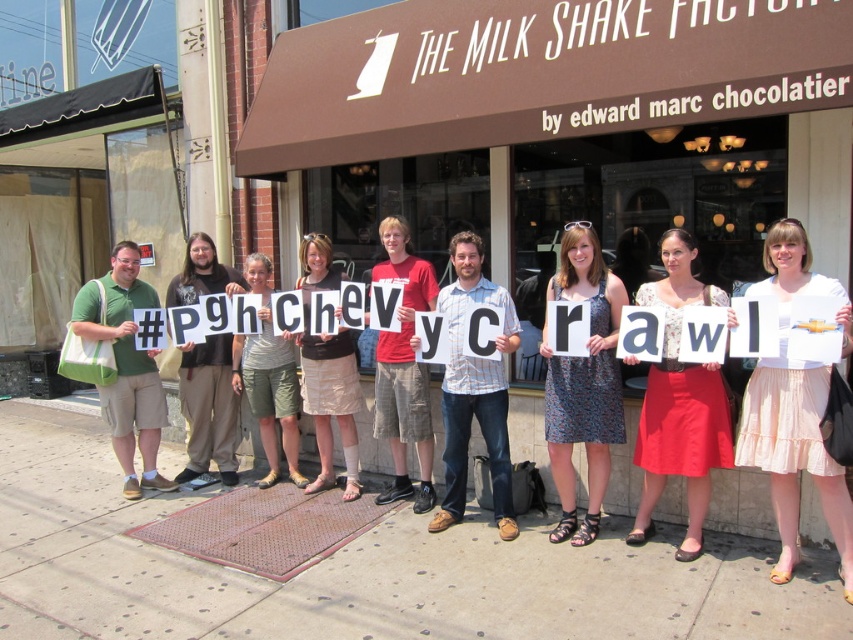
You are attending the Pittsburgh Chevy Crawl event and notice two attendees wearing a pink cotton skirt at center and a matte white dress at center. Which outfit takes up more horizontal space?

The pink cotton skirt at center has a greater width than the matte white dress at center, so it takes up more horizontal space.

You are attending a fashion event and notice two garments displayed on a model in the center of the image. The garments are the printed fabric dress at center and the beige fabric skirt at center. Which garment is positioned lower on the model?

The printed fabric dress at center is located below the beige fabric skirt at center, so the dress is positioned lower on the model.